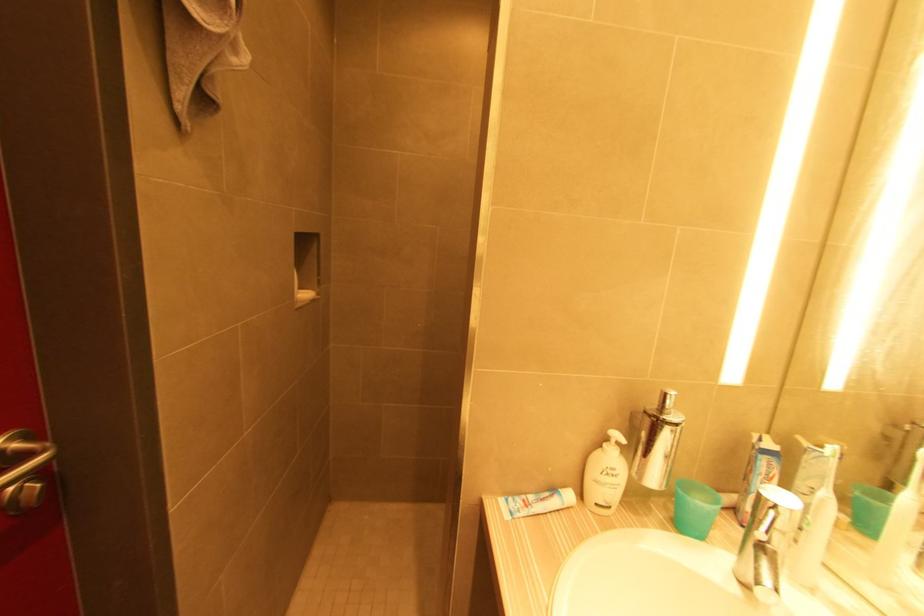
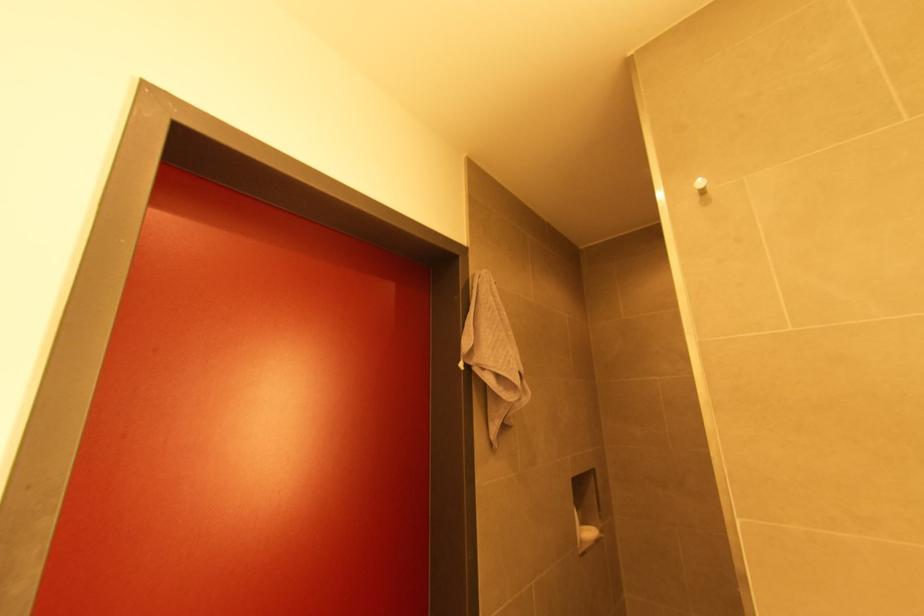
First-person continuous shooting, in which direction is the camera rotating?

The camera rotated toward left-up.